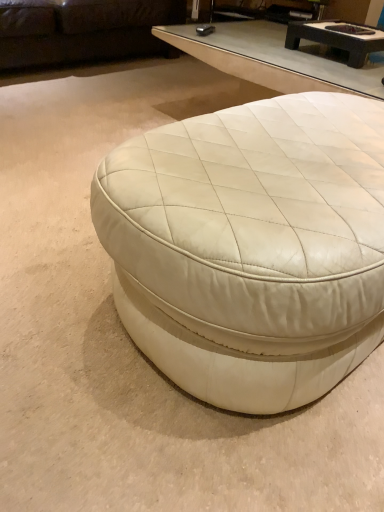
Question: Is dark brown leather couch at upper left turned away from dark brown textured wood coffee table at upper center, acting as the 1th coffee table starting from the back?

Choices:
 (A) no
 (B) yes

Answer: (A)

Question: Is dark brown leather couch at upper left shorter than dark brown textured wood coffee table at upper center, the second coffee table in the bottom-to-top sequence?

Choices:
 (A) no
 (B) yes

Answer: (A)

Question: From a real-world perspective, is dark brown leather couch at upper left physically below dark brown textured wood coffee table at upper center, acting as the 1th coffee table starting from the back?

Choices:
 (A) no
 (B) yes

Answer: (B)

Question: From the image's perspective, is dark brown leather couch at upper left below dark brown textured wood coffee table at upper center, positioned as the first coffee table in top-to-bottom order?

Choices:
 (A) yes
 (B) no

Answer: (B)

Question: Are dark brown leather couch at upper left and dark brown textured wood coffee table at upper center, acting as the 1th coffee table starting from the back, far apart?

Choices:
 (A) no
 (B) yes

Answer: (B)

Question: Is point (92, 32) closer or farther from the camera than point (155, 365)?

Choices:
 (A) farther
 (B) closer

Answer: (A)

Question: Do you think dark brown leather couch at upper left is within white leather ottoman at center, which is the 2th coffee table in back-to-front order, or outside of it?

Choices:
 (A) inside
 (B) outside

Answer: (B)

Question: Is dark brown leather couch at upper left bigger or smaller than white leather ottoman at center, positioned as the second coffee table in top-to-bottom order?

Choices:
 (A) big
 (B) small

Answer: (A)

Question: From the image's perspective, relative to white leather ottoman at center, the 1th coffee table in the front-to-back sequence, is dark brown leather couch at upper left above or below?

Choices:
 (A) below
 (B) above

Answer: (B)

Question: Is dark brown textured wood coffee table at upper center, positioned as the first coffee table in top-to-bottom order, in front of or behind dark brown leather couch at upper left in the image?

Choices:
 (A) front
 (B) behind

Answer: (A)

Question: From a real-world perspective, is dark brown textured wood coffee table at upper center, positioned as the first coffee table in top-to-bottom order, physically located above or below dark brown leather couch at upper left?

Choices:
 (A) below
 (B) above

Answer: (B)

Question: Based on their sizes in the image, would you say dark brown textured wood coffee table at upper center, acting as the second coffee table starting from the front, is bigger or smaller than dark brown leather couch at upper left?

Choices:
 (A) big
 (B) small

Answer: (B)

Question: Is point (357, 45) closer or farther from the camera than point (49, 10)?

Choices:
 (A) closer
 (B) farther

Answer: (A)

Question: Is dark brown textured wood coffee table at upper center, acting as the second coffee table starting from the front, bigger or smaller than white leather ottoman at center, the 1th coffee table in the front-to-back sequence?

Choices:
 (A) small
 (B) big

Answer: (A)

Question: Considering the positions of dark brown textured wood coffee table at upper center, acting as the second coffee table starting from the front, and white leather ottoman at center, the 1th coffee table in the front-to-back sequence, in the image, is dark brown textured wood coffee table at upper center, acting as the second coffee table starting from the front, wider or thinner than white leather ottoman at center, the 1th coffee table in the front-to-back sequence,?

Choices:
 (A) thin
 (B) wide

Answer: (A)